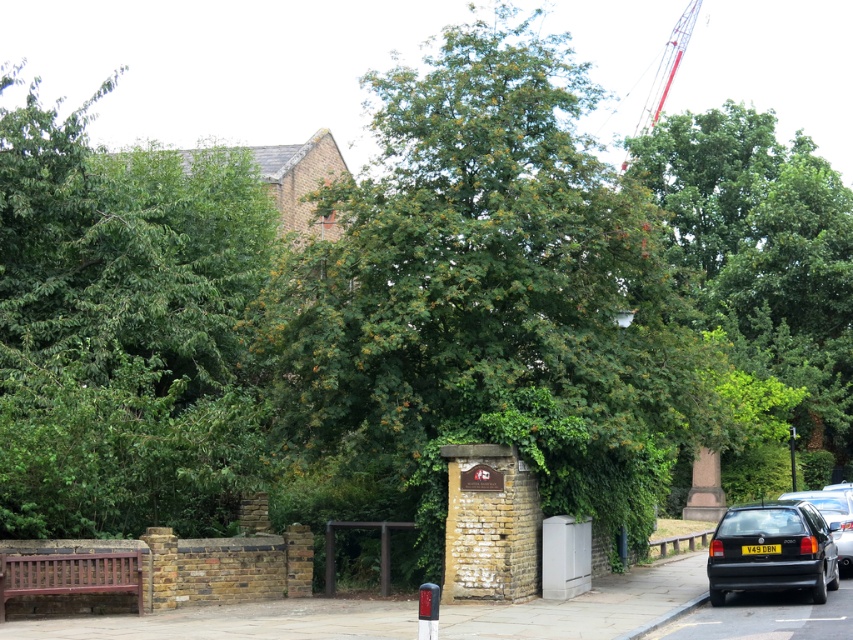
Between green leafy tree at upper right and metallic red crane at upper right, which one has less height?

With less height is green leafy tree at upper right.

I want to click on green leafy tree at upper right, so click(x=761, y=253).

Does point (827, 307) come in front of point (625, 157)?

Yes, it is in front of point (625, 157).

Where is `green leafy tree at upper right`? The image size is (853, 640). green leafy tree at upper right is located at coordinates (761, 253).

Is point (780, 509) farther from viewer compared to point (759, 612)?

Yes.

Is matte black hatchback at lower right taller than black asphalt pavement at lower right?

Indeed, matte black hatchback at lower right has a greater height compared to black asphalt pavement at lower right.

Is point (737, 554) positioned before point (850, 588)?

That is True.

The image size is (853, 640). In order to click on matte black hatchback at lower right in this screenshot , I will do (x=772, y=550).

Who is more forward, (61,497) or (84,577)?

Positioned in front is point (84,577).

Is green leafy tree at left below wooden bench at lower left?

No.

Identify the location of green leafy tree at left. The height and width of the screenshot is (640, 853). (123, 330).